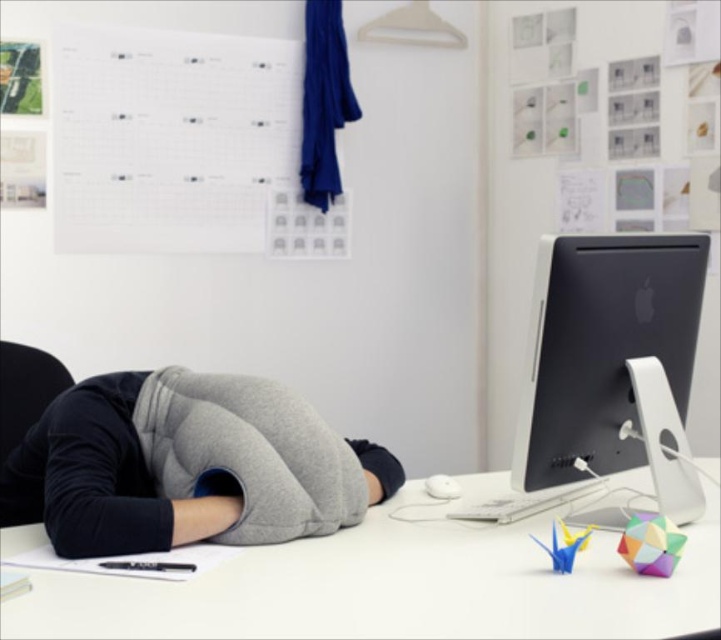
You are organizing a small event and need to place a 1.5 meter long banner on the desk. Given the dimensions of the white matte computer desk at center and the black matte desktop computer at right, can the banner fit horizontally on the desk without overlapping the computer?

The white matte computer desk at center is smaller than the black matte desktop computer at right. Since the desk is smaller than the computer, the desk itself might not be long enough to accommodate a 1.5 meter banner without overlapping the computer.

You are organizing a small party and need to place a cake on the white matte computer desk at center and the gray fleece pillow at center. Which object should you place the cake on to ensure it is closer to the right edge of the desk?

The white matte computer desk at center is positioned on the right side of the gray fleece pillow at center, so placing the cake on the white matte computer desk at center will ensure it is closer to the right edge of the desk.